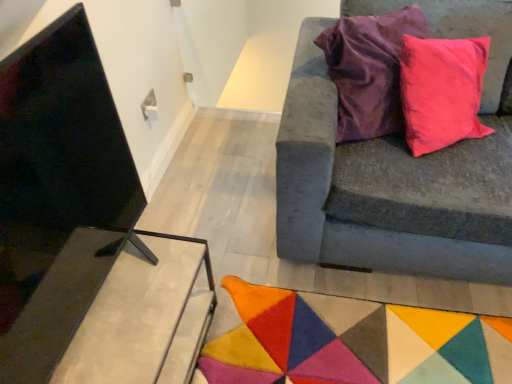
The width and height of the screenshot is (512, 384). I want to click on velvet gray couch at right, so click(x=387, y=190).

Describe the element at coordinates (114, 314) in the screenshot. I see `metallic concrete table at lower left` at that location.

Measure the distance between point (200,367) and camera.

Point (200,367) is 1.42 meters from camera.

The height and width of the screenshot is (384, 512). I want to click on velvet gray couch at right, so click(x=387, y=190).

Which object is thinner, multicolored felt mat at lower center or velvet gray couch at right?

With smaller width is velvet gray couch at right.

Considering the sizes of objects multicolored felt mat at lower center and velvet gray couch at right in the image provided, who is taller, multicolored felt mat at lower center or velvet gray couch at right?

velvet gray couch at right is taller.

In terms of size, does multicolored felt mat at lower center appear bigger or smaller than velvet gray couch at right?

Clearly, multicolored felt mat at lower center is smaller in size than velvet gray couch at right.

In the scene shown: Would you say multicolored felt mat at lower center is inside or outside velvet gray couch at right?

The correct answer is: outside.

From their relative heights in the image, would you say multicolored felt mat at lower center is taller or shorter than metallic concrete table at lower left?

In the image, multicolored felt mat at lower center appears to be shorter than metallic concrete table at lower left.

Considering the positions of objects multicolored felt mat at lower center and metallic concrete table at lower left in the image provided, who is behind, multicolored felt mat at lower center or metallic concrete table at lower left?

multicolored felt mat at lower center is further away from the camera.

From the image's perspective, which is above, multicolored felt mat at lower center or metallic concrete table at lower left?

metallic concrete table at lower left, from the image's perspective.

Is multicolored felt mat at lower center positioned beyond the bounds of metallic concrete table at lower left?

That's correct, multicolored felt mat at lower center is outside of metallic concrete table at lower left.

From a real-world perspective, between velvet gray couch at right and multicolored felt mat at lower center, who is vertically lower?

multicolored felt mat at lower center, from a real-world perspective.

Visually, is velvet gray couch at right positioned to the left or to the right of multicolored felt mat at lower center?

Based on their positions, velvet gray couch at right is located to the right of multicolored felt mat at lower center.

Which is in front, point (298, 215) or point (411, 338)?

The point (411, 338) is closer.

Is metallic concrete table at lower left oriented towards velvet gray couch at right?

No, metallic concrete table at lower left is not aimed at velvet gray couch at right.

Would you consider metallic concrete table at lower left to be distant from velvet gray couch at right?

No.

Locate an element on the screen. The width and height of the screenshot is (512, 384). studio couch that appears on the right of metallic concrete table at lower left is located at coordinates (387, 190).

Does metallic concrete table at lower left lie in front of velvet gray couch at right?

→ No, the depth of metallic concrete table at lower left is greater than that of velvet gray couch at right.

Looking at this image, measure the distance from velvet gray couch at right to metallic concrete table at lower left.

They are 29.16 inches apart.

From a real-world perspective, is velvet gray couch at right physically below metallic concrete table at lower left?

Actually, velvet gray couch at right is physically above metallic concrete table at lower left in the real world.

Between velvet gray couch at right and metallic concrete table at lower left, which one has larger size?

velvet gray couch at right is bigger.

Is metallic concrete table at lower left at the back of velvet gray couch at right?

No, velvet gray couch at right's orientation is not away from metallic concrete table at lower left.

Does metallic concrete table at lower left have a lesser width compared to multicolored felt mat at lower center?

Yes.

Considering the relative sizes of metallic concrete table at lower left and multicolored felt mat at lower center in the image provided, is metallic concrete table at lower left smaller than multicolored felt mat at lower center?

No, metallic concrete table at lower left is not smaller than multicolored felt mat at lower center.

Is point (198, 340) closer or farther from the camera than point (360, 334)?

Point (198, 340) is closer to the camera than point (360, 334).

Looking at this image, which object is closer to the camera, metallic concrete table at lower left or multicolored felt mat at lower center?

metallic concrete table at lower left is more forward.

Locate an element on the screen. mat that appears on the left of velvet gray couch at right is located at coordinates (352, 342).

At what (x,y) coordinates should I click in order to perform the action: click on mat located on the right of metallic concrete table at lower left. Please return your answer as a coordinate pair (x, y). The image size is (512, 384). Looking at the image, I should click on (352, 342).

When comparing their distances from velvet gray couch at right, does multicolored felt mat at lower center or metallic concrete table at lower left seem further?

Among the two, metallic concrete table at lower left is located further to velvet gray couch at right.

Estimate the real-world distances between objects in this image. Which object is further from multicolored felt mat at lower center, velvet gray couch at right or metallic concrete table at lower left?

The object further to multicolored felt mat at lower center is metallic concrete table at lower left.

Which object lies nearer to the anchor point metallic concrete table at lower left, velvet gray couch at right or multicolored felt mat at lower center?

multicolored felt mat at lower center lies closer to metallic concrete table at lower left than the other object.

From the image, which object appears to be farther from multicolored felt mat at lower center, metallic concrete table at lower left or velvet gray couch at right?

metallic concrete table at lower left is positioned further to the anchor multicolored felt mat at lower center.

Looking at the image, which one is located closer to metallic concrete table at lower left, multicolored felt mat at lower center or velvet gray couch at right?

Among the two, multicolored felt mat at lower center is located nearer to metallic concrete table at lower left.

Considering their positions, is metallic concrete table at lower left positioned further to velvet gray couch at right than multicolored felt mat at lower center?

Based on the image, metallic concrete table at lower left appears to be further to velvet gray couch at right.

Locate an element on the screen. mat between metallic concrete table at lower left and velvet gray couch at right in the horizontal direction is located at coordinates (352, 342).